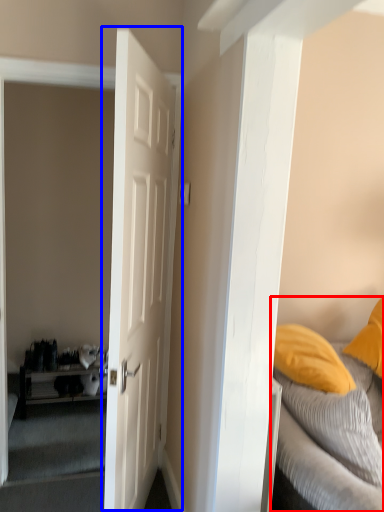
Question: Which object is further to the camera taking this photo, bed (highlighted by a red box) or door (highlighted by a blue box)?

Choices:
 (A) bed
 (B) door

Answer: (A)